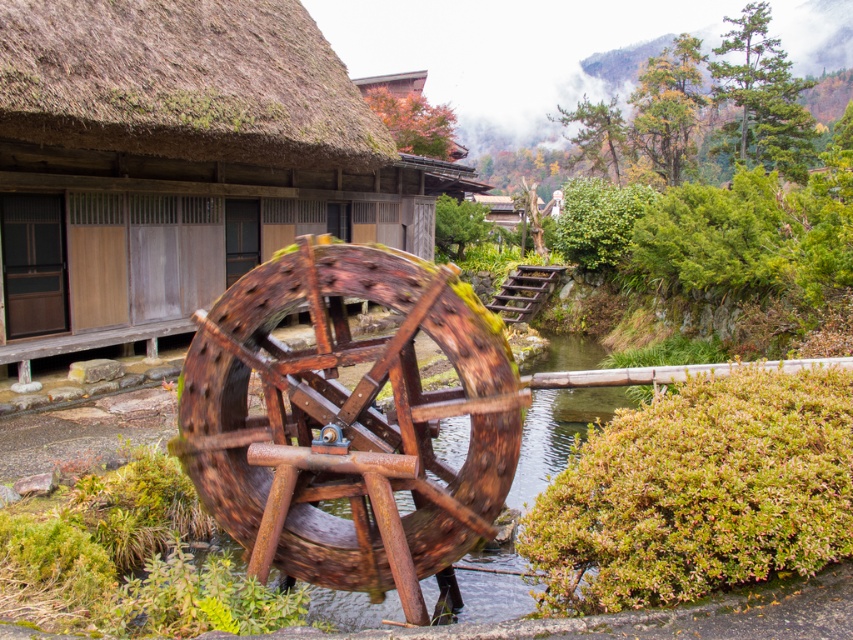
Question: Which of the following is the farthest from the observer?

Choices:
 (A) (218, 129)
 (B) (495, 509)

Answer: (A)

Question: Which point is closer to the camera taking this photo?

Choices:
 (A) (25, 344)
 (B) (334, 355)

Answer: (B)

Question: Can you confirm if rusty wood water wheel at center is wider than rusty wood wagon wheel at center?

Choices:
 (A) yes
 (B) no

Answer: (B)

Question: Observing the image, what is the correct spatial positioning of rusty wood water wheel at center in reference to rusty wood wagon wheel at center?

Choices:
 (A) above
 (B) below

Answer: (A)

Question: Is rusty wood water wheel at center to the right of rusty wood wagon wheel at center from the viewer's perspective?

Choices:
 (A) yes
 (B) no

Answer: (B)